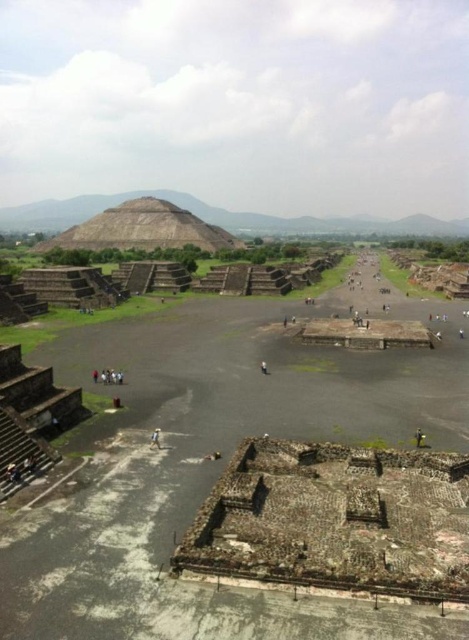
Question: Can you confirm if smooth stone pyramid at center is bigger than yellow fabric person at center?

Choices:
 (A) yes
 (B) no

Answer: (A)

Question: Estimate the real-world distances between objects in this image. Which object is closer to the blurred human figure at center?

Choices:
 (A) white fabric person at center
 (B) smooth stone pyramid at center
 (C) yellow fabric person at center
 (D) rusty stone ruins at center

Answer: (D)

Question: Which point is closer to the camera?

Choices:
 (A) blurred human figure at center
 (B) rusty stone ruins at center
 (C) smooth stone pyramid at center
 (D) white fabric person at center

Answer: (B)

Question: Is blurred human figure at center smaller than white fabric person at center?

Choices:
 (A) yes
 (B) no

Answer: (A)

Question: Can you confirm if smooth stone pyramid at center is smaller than white fabric person at center?

Choices:
 (A) no
 (B) yes

Answer: (A)

Question: Estimate the real-world distances between objects in this image. Which object is farther from the white fabric person at center?

Choices:
 (A) smooth stone pyramid at center
 (B) blurred human figure at center

Answer: (A)